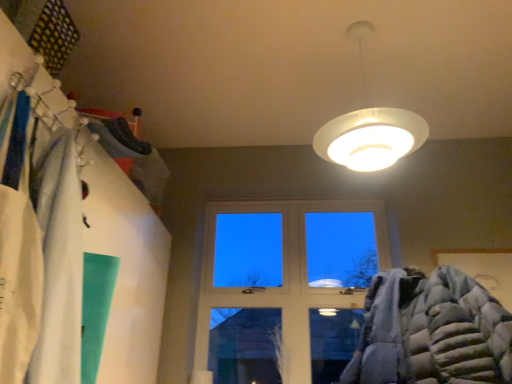
At what (x,y) coordinates should I click in order to perform the action: click on transparent glass window at center. Please return your answer as a coordinate pair (x, y). The height and width of the screenshot is (384, 512). Looking at the image, I should click on (286, 287).

This screenshot has width=512, height=384. Describe the element at coordinates (286, 287) in the screenshot. I see `transparent glass window at center` at that location.

Locate an element on the screen. The height and width of the screenshot is (384, 512). white glossy lampshade at upper center is located at coordinates (369, 127).

Describe the element at coordinates (369, 127) in the screenshot. I see `white glossy lampshade at upper center` at that location.

This screenshot has height=384, width=512. Identify the location of transparent glass window at center. (286, 287).

Is white glossy lampshade at upper center to the right of transparent glass window at center from the viewer's perspective?

Correct, you'll find white glossy lampshade at upper center to the right of transparent glass window at center.

Considering the relative positions of white glossy lampshade at upper center and transparent glass window at center in the image provided, is white glossy lampshade at upper center in front of transparent glass window at center?

Yes, white glossy lampshade at upper center is closer to the viewer.

Is point (412, 119) closer or farther from the camera than point (244, 215)?

Point (412, 119).

In the scene shown: From the image's perspective, is white glossy lampshade at upper center beneath transparent glass window at center?

Incorrect, from the image's perspective, white glossy lampshade at upper center is higher than transparent glass window at center.

From a real-world perspective, is white glossy lampshade at upper center on transparent glass window at center?

Indeed, from a real-world perspective, white glossy lampshade at upper center stands above transparent glass window at center.

Which of these two, white glossy lampshade at upper center or transparent glass window at center, is thinner?

transparent glass window at center.

Who is taller, white glossy lampshade at upper center or transparent glass window at center?

transparent glass window at center is taller.

Does white glossy lampshade at upper center have a smaller size compared to transparent glass window at center?

No.

Is white glossy lampshade at upper center spatially inside transparent glass window at center, or outside of it?

white glossy lampshade at upper center cannot be found inside transparent glass window at center.

Is white glossy lampshade at upper center beside transparent glass window at center?

white glossy lampshade at upper center and transparent glass window at center are not in contact.

Is transparent glass window at center at the back of white glossy lampshade at upper center?

Yes, white glossy lampshade at upper center is positioned with its back facing transparent glass window at center.

What's the angular difference between white glossy lampshade at upper center and transparent glass window at center's facing directions?

4.77 degrees.

Image resolution: width=512 pixels, height=384 pixels. I want to click on window lying on the left of white glossy lampshade at upper center, so click(286, 287).

Looking at this image, between transparent glass window at center and white glossy lampshade at upper center, which one appears on the right side from the viewer's perspective?

white glossy lampshade at upper center.

Considering their positions, is transparent glass window at center located in front of or behind white glossy lampshade at upper center?

In the image, transparent glass window at center appears behind white glossy lampshade at upper center.

Which is farther from the camera, (206, 337) or (421, 139)?

Point (206, 337)

From the image's perspective, is transparent glass window at center above or below white glossy lampshade at upper center?

Based on their image positions, transparent glass window at center is located beneath white glossy lampshade at upper center.

From a real-world perspective, is transparent glass window at center positioned over white glossy lampshade at upper center based on gravity?

No, from a real-world perspective, transparent glass window at center is not above white glossy lampshade at upper center.

Considering the sizes of transparent glass window at center and white glossy lampshade at upper center in the image, is transparent glass window at center wider or thinner than white glossy lampshade at upper center?

transparent glass window at center is thinner than white glossy lampshade at upper center.

Consider the image. Is transparent glass window at center taller or shorter than white glossy lampshade at upper center?

In the image, transparent glass window at center appears to be taller than white glossy lampshade at upper center.

Can you confirm if transparent glass window at center is bigger than white glossy lampshade at upper center?

Incorrect, transparent glass window at center is not larger than white glossy lampshade at upper center.

Choose the correct answer: Is transparent glass window at center inside white glossy lampshade at upper center or outside it?

transparent glass window at center is located beyond the bounds of white glossy lampshade at upper center.

Is transparent glass window at center next to white glossy lampshade at upper center and touching it?

transparent glass window at center is not next to white glossy lampshade at upper center, and they're not touching.

Does transparent glass window at center turn towards white glossy lampshade at upper center?

Yes, transparent glass window at center is aimed at white glossy lampshade at upper center.

Can you tell me how much transparent glass window at center and white glossy lampshade at upper center differ in facing direction?

The facing directions of transparent glass window at center and white glossy lampshade at upper center are 4.77 degrees apart.

Find the location of `lamp above the transparent glass window at center (from a real-world perspective)`. lamp above the transparent glass window at center (from a real-world perspective) is located at coordinates (369, 127).

Locate an element on the screen. This screenshot has width=512, height=384. window below the white glossy lampshade at upper center (from a real-world perspective) is located at coordinates (286, 287).

At what (x,y) coordinates should I click in order to perform the action: click on lamp above the transparent glass window at center (from a real-world perspective). Please return your answer as a coordinate pair (x, y). This screenshot has width=512, height=384. Looking at the image, I should click on (369, 127).